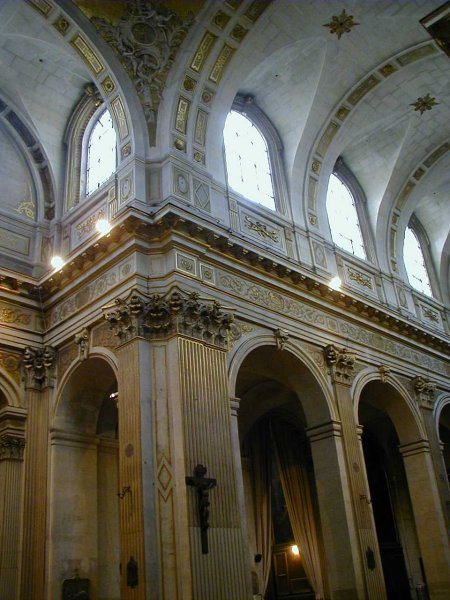
You are a GUI agent. You are given a task and a screenshot of the screen. Output one action in this format:
    pyautogui.click(x=<x>, y=<y>)
    Task: Click on the lights
    
    Given the screenshot: What is the action you would take?
    pyautogui.click(x=55, y=262), pyautogui.click(x=102, y=225), pyautogui.click(x=336, y=283)